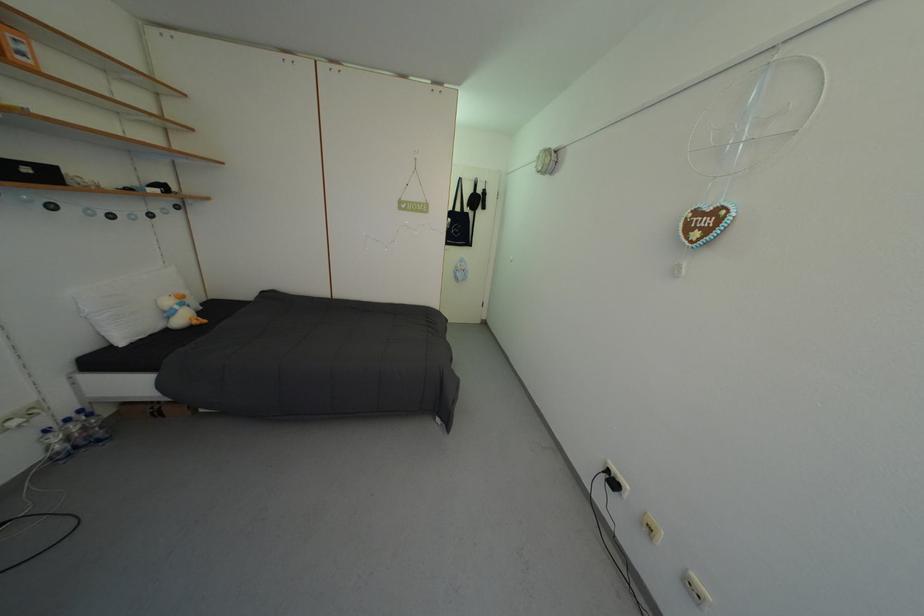
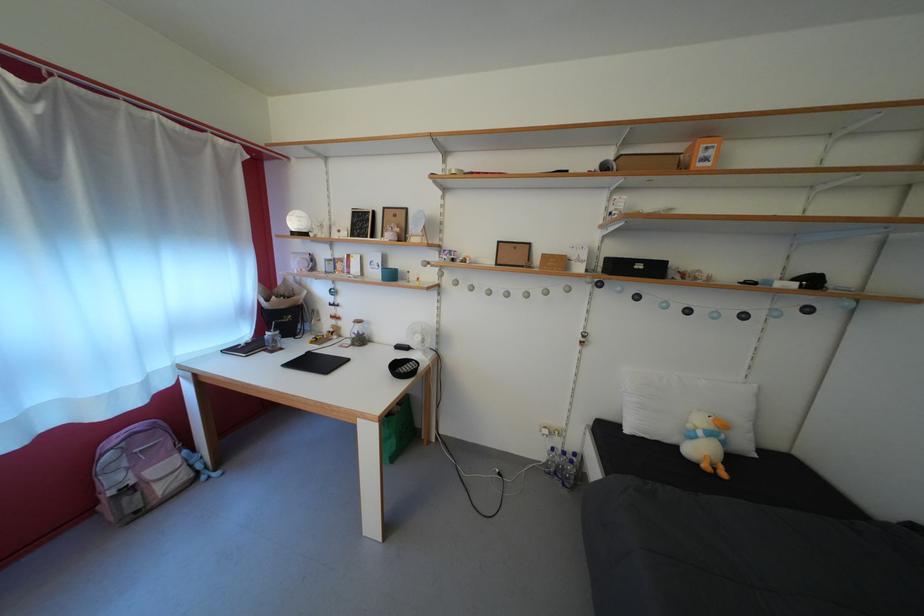
Find the pixel in the second image that matches (35,176) in the first image.

(648, 273)